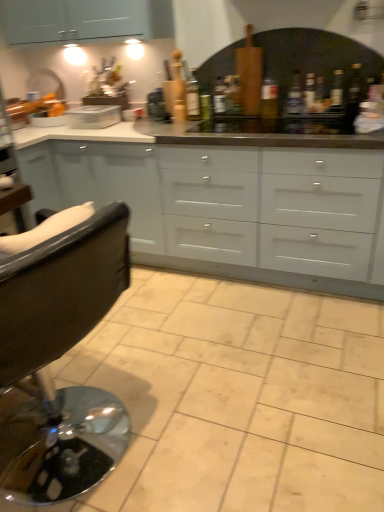
Where is `vacant space situated above white matte cupboard at center (from a real-world perspective)`? This screenshot has height=512, width=384. vacant space situated above white matte cupboard at center (from a real-world perspective) is located at coordinates (225, 124).